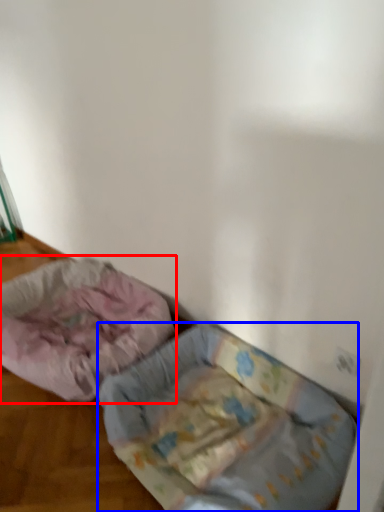
Question: Among these objects, which one is nearest to the camera, dog bed (highlighted by a red box) or dog bed (highlighted by a blue box)?

Choices:
 (A) dog bed
 (B) dog bed

Answer: (B)